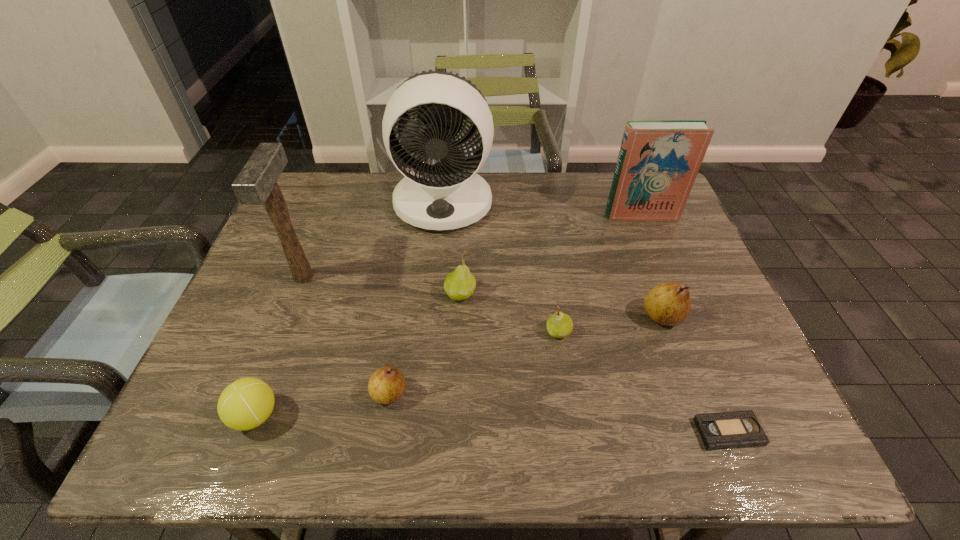
Where is `videotape situated at the right edge`? The width and height of the screenshot is (960, 540). videotape situated at the right edge is located at coordinates (738, 429).

Where is `object at the near left corner`? The height and width of the screenshot is (540, 960). object at the near left corner is located at coordinates (245, 404).

Identify the location of object positioned at the far right corner. The height and width of the screenshot is (540, 960). (658, 162).

Identify the location of object at the near right corner. (738, 429).

In order to click on vacant space at the far edge of the desktop in this screenshot , I will do `click(377, 180)`.

Identify the location of free region at the near edge of the desktop. The width and height of the screenshot is (960, 540). (272, 437).

Identify the location of vacant region at the left edge of the desktop. (232, 346).

At what (x,y) coordinates should I click in order to perform the action: click on free space at the right edge. Please return your answer as a coordinate pair (x, y). This screenshot has width=960, height=540. Looking at the image, I should click on (706, 335).

In the image, there is a desktop. Where is `free space at the near left corner`? The width and height of the screenshot is (960, 540). free space at the near left corner is located at coordinates (160, 455).

At what (x,y) coordinates should I click in order to perform the action: click on free space between the fan and the third tallest object. Please return your answer as a coordinate pair (x, y). The image size is (960, 540). Looking at the image, I should click on (542, 209).